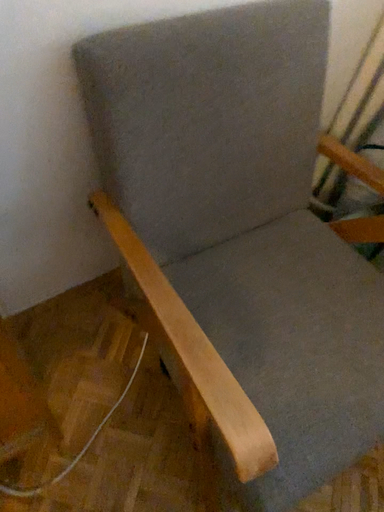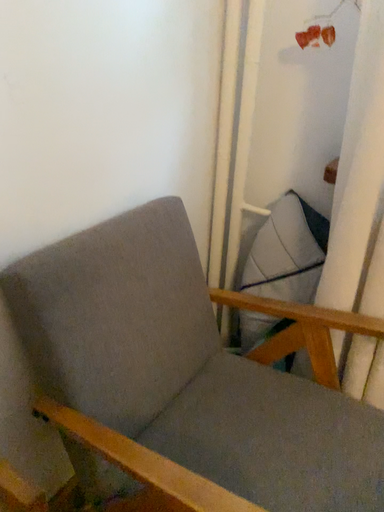
Question: Which way did the camera rotate in the video?

Choices:
 (A) rotated downward
 (B) rotated upward

Answer: (B)